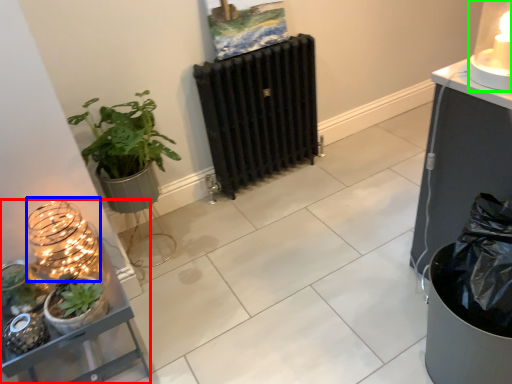
Question: Which is nearer to the shelf (highlighted by a red box)? candle holder (highlighted by a blue box) or candle holder (highlighted by a green box).

Choices:
 (A) candle holder
 (B) candle holder

Answer: (A)